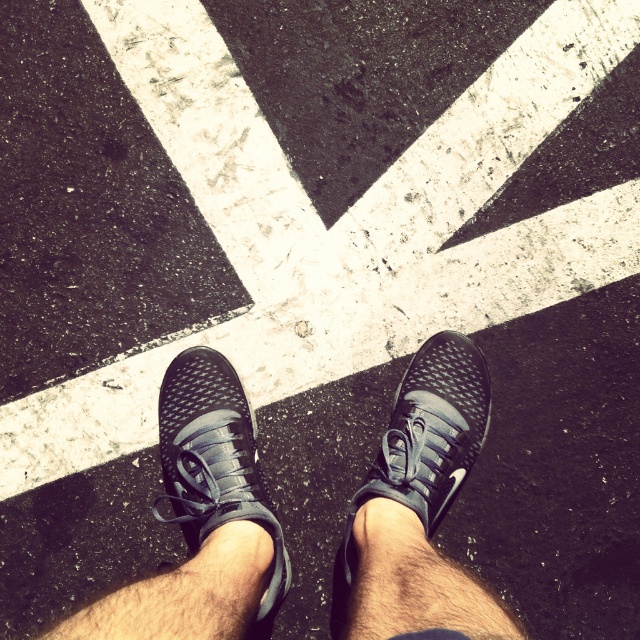
Does black mesh sneakers at center appear over matte black shoe at center?

No, black mesh sneakers at center is not above matte black shoe at center.

Who is positioned more to the right, black mesh sneakers at center or matte black shoe at center?

From the viewer's perspective, matte black shoe at center appears more on the right side.

Who is more distant from viewer, (193,401) or (356,602)?

The point (193,401) is behind.

The height and width of the screenshot is (640, 640). Find the location of `black mesh sneakers at center`. black mesh sneakers at center is located at coordinates point(419,508).

Is point (177, 417) farther from camera compared to point (225, 445)?

Yes.

Can you confirm if black mesh sneakers at center is positioned above matte black sneaker at center?

Incorrect, black mesh sneakers at center is not positioned above matte black sneaker at center.

Identify the location of black mesh sneakers at center. (419, 508).

Does matte black shoe at center have a smaller size compared to matte black sneaker at center?

No, matte black shoe at center is not smaller than matte black sneaker at center.

Is point (509, 636) in front of point (184, 531)?

That is True.

Identify the location of matte black shoe at center. The width and height of the screenshot is (640, 640). (419, 508).